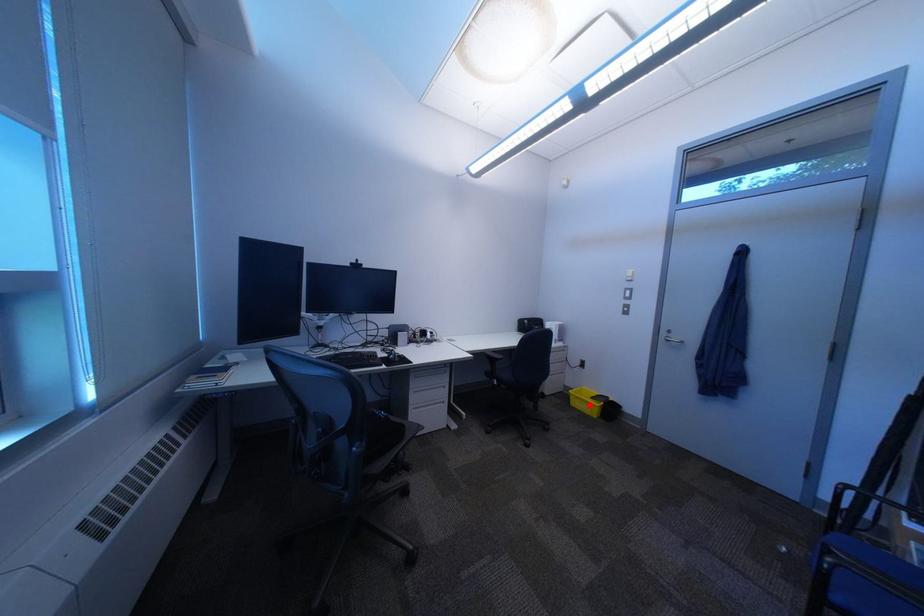
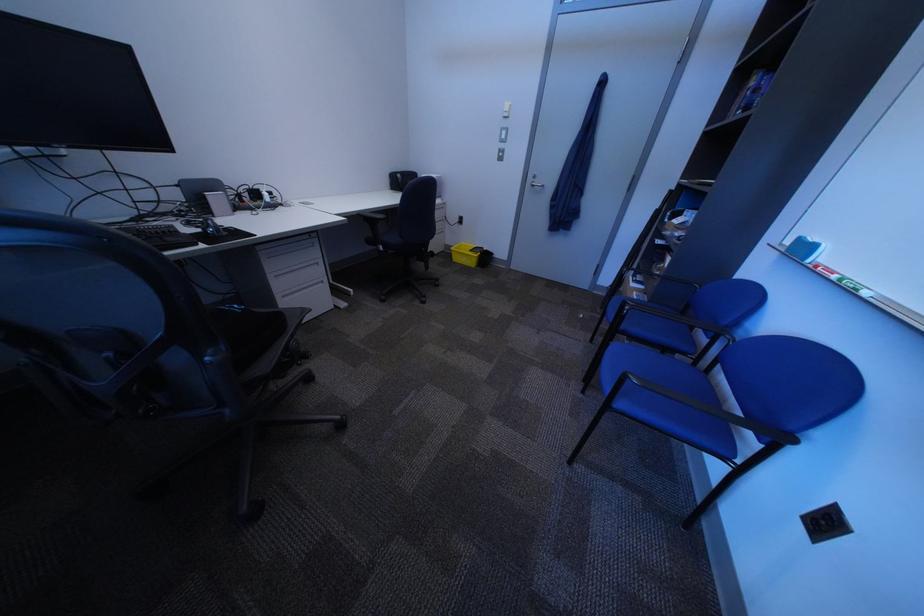
Question: I am providing you with two images of the same scene from different viewpoints. In image1, a red point is highlighted. Considering the same 3D point in image2, which of the following is correct?

Choices:
 (A) It is closer
 (B) It is farther

Answer: (A)